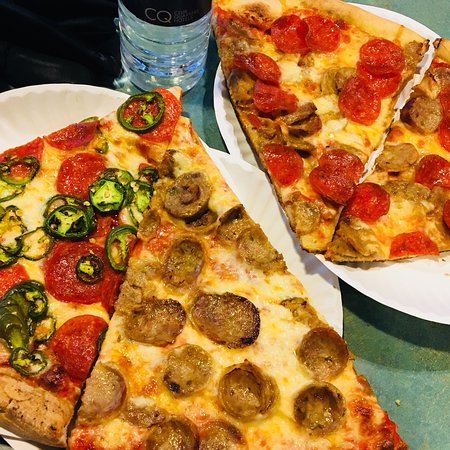
The width and height of the screenshot is (450, 450). Identify the location of bottle. (133, 31).